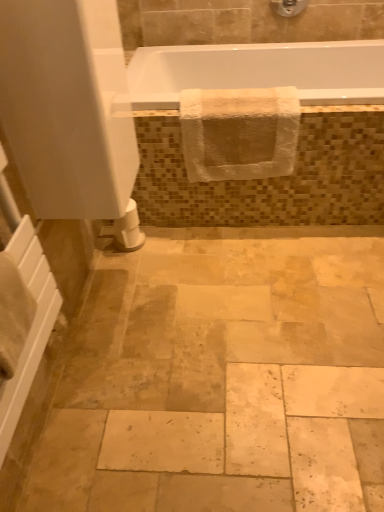
Where is `free space to the right of white matte toilet paper at lower left`? This screenshot has width=384, height=512. free space to the right of white matte toilet paper at lower left is located at coordinates tap(173, 240).